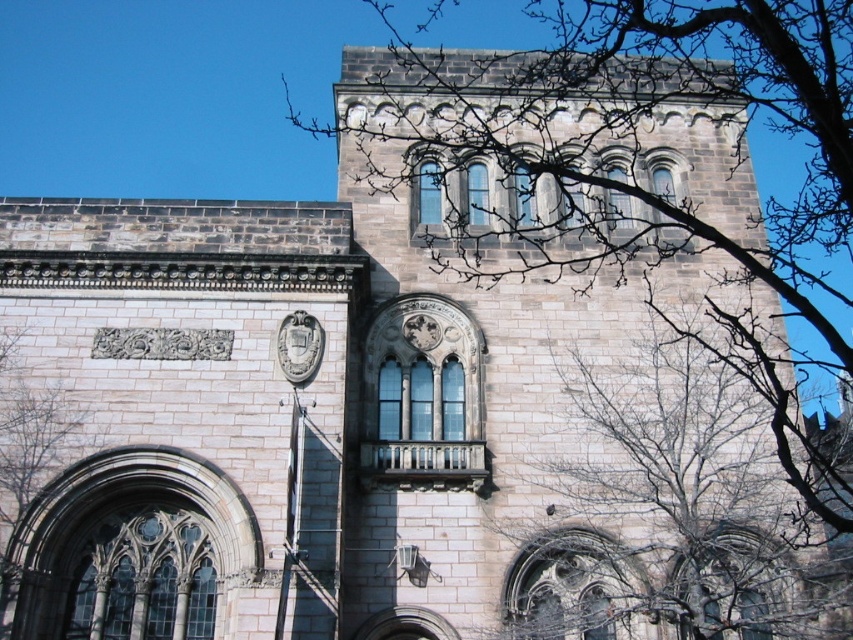
Question: Among these points, which one is nearest to the camera?

Choices:
 (A) (635, 346)
 (B) (68, 424)

Answer: (B)

Question: Is bare branches at center bigger than bare branches at left?

Choices:
 (A) no
 (B) yes

Answer: (B)

Question: From the image, what is the correct spatial relationship of bare branches at center in relation to bare branches at left?

Choices:
 (A) below
 (B) above

Answer: (A)

Question: Can you confirm if bare branches at center is wider than bare branches at left?

Choices:
 (A) yes
 (B) no

Answer: (A)